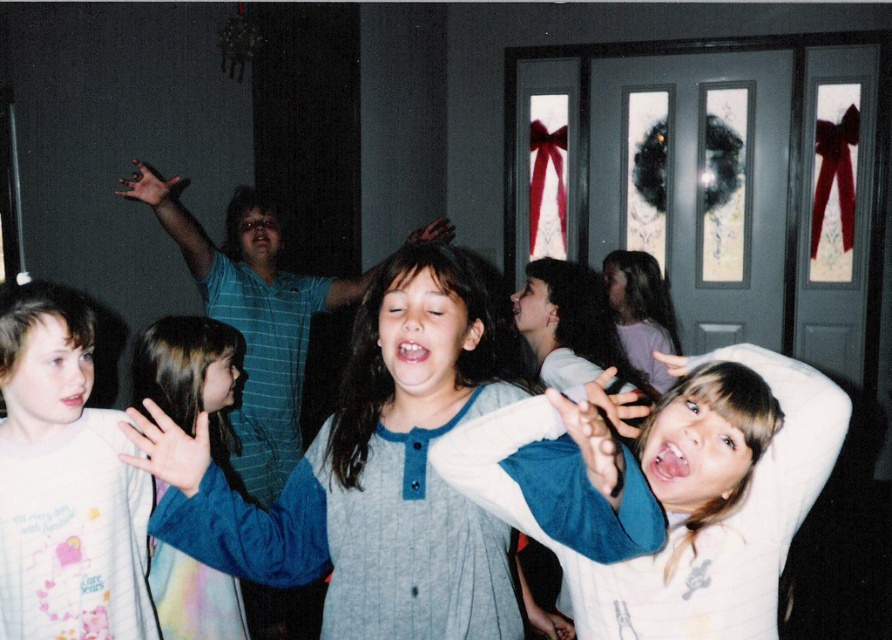
You are a parent trying to decide which blue item to take from the center of the image. You see the blue striped pajamas at center and the blue fabric shirt at center. Which one is positioned higher up?

The blue striped pajamas at center is located above the blue fabric shirt at center, so the blue striped pajamas at center is positioned higher up.

You are standing in front of the door with red bows and a wreath and want to take a photo of the point at coordinates [364,483]. Is the point within your camera frame which has a maximum distance of 1.5 meters?

The point at coordinates [364,483] is 1.25 meters from the camera, which is within the maximum distance of 1.5 meters. Therefore, the point is within the camera frame.

You are a parent trying to decide which clothing item to put on your child first. The blue striped pajamas at center and the blue fabric shirt at center are both available. Based on their sizes, which one would be easier to put on quickly?

The blue fabric shirt at center is easier to put on quickly because it is narrower than the blue striped pajamas at center, which are wider.